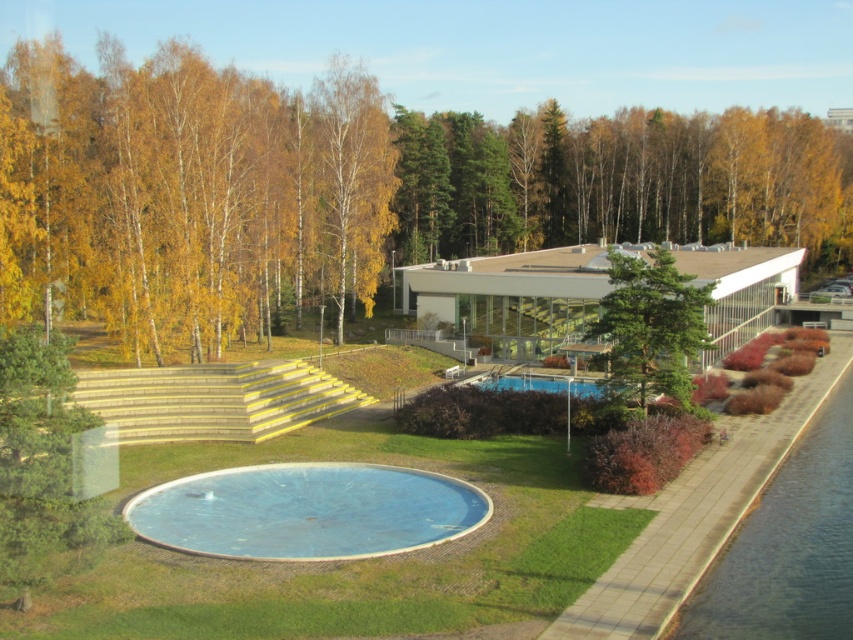
Question: Which of the following is the closest to the observer?

Choices:
 (A) (456, 500)
 (B) (596, 381)
 (C) (97, 224)
 (D) (90, 97)

Answer: (A)

Question: Observing the image, what is the correct spatial positioning of green leafy tree at center in reference to green textured tree at center?

Choices:
 (A) left
 (B) right

Answer: (B)

Question: Estimate the real-world distances between objects in this image. Which object is farther from the blue glass swimming pool at center?

Choices:
 (A) green textured tree at center
 (B) yellow/golden bark at upper left
 (C) blue smooth pool at center
 (D) green leafy tree at center

Answer: (D)

Question: Is yellow/golden bark at upper left bigger than green textured tree at center?

Choices:
 (A) yes
 (B) no

Answer: (A)

Question: Observing the image, what is the correct spatial positioning of blue smooth pool at center in reference to green textured tree at center?

Choices:
 (A) left
 (B) right

Answer: (A)

Question: Which point is farther to the camera?

Choices:
 (A) blue glass swimming pool at center
 (B) yellow/golden bark at upper left
 (C) green leafy tree at center
 (D) blue smooth pool at center

Answer: (C)